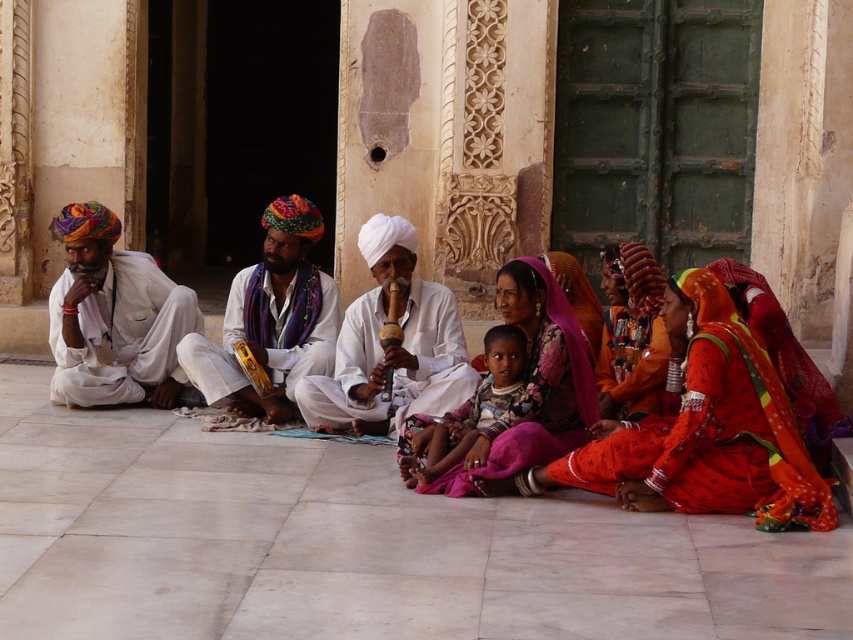
You are a photographer trying to capture a closeup of the shiny orange fabric at center without the matte white turban at center blocking the view. Based on their sizes, which object should you focus on first to ensure it fits entirely in the frame?

The matte white turban at center is bigger than the shiny orange fabric at center, so you should focus on the matte white turban at center first to ensure it fits entirely in the frame before adjusting for the smaller shiny orange fabric at center.